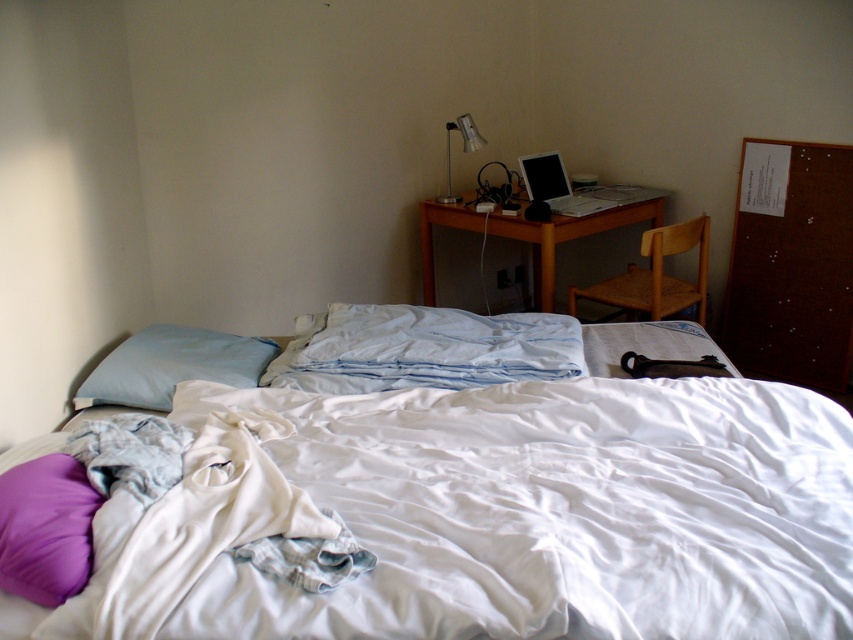
Is point (440, 320) farther from viewer compared to point (51, 456)?

That is True.

Which is in front, point (454, 381) or point (24, 465)?

Positioned in front is point (24, 465).

In order to click on blue cotton sheet at center in this screenshot , I will do `click(422, 349)`.

The width and height of the screenshot is (853, 640). Identify the location of blue cotton sheet at center. (422, 349).

Measure the distance between point (466, 461) and camera.

A distance of 5.45 feet exists between point (466, 461) and camera.

From the picture: Who is taller, white cotton bed at center or wooden desk at center?

Standing taller between the two is wooden desk at center.

Based on the photo, measure the distance between white cotton bed at center and camera.

1.15 meters

Find the location of a particular element. white cotton bed at center is located at coordinates (x=556, y=508).

Who is positioned more to the left, purple fabric pillow at lower left or wooden desk at center?

purple fabric pillow at lower left is more to the left.

Is point (61, 554) more distant than point (534, 250)?

No, (61, 554) is closer to viewer.

What do you see at coordinates (45, 529) in the screenshot?
I see `purple fabric pillow at lower left` at bounding box center [45, 529].

Where is `purple fabric pillow at lower left`? The width and height of the screenshot is (853, 640). purple fabric pillow at lower left is located at coordinates (45, 529).